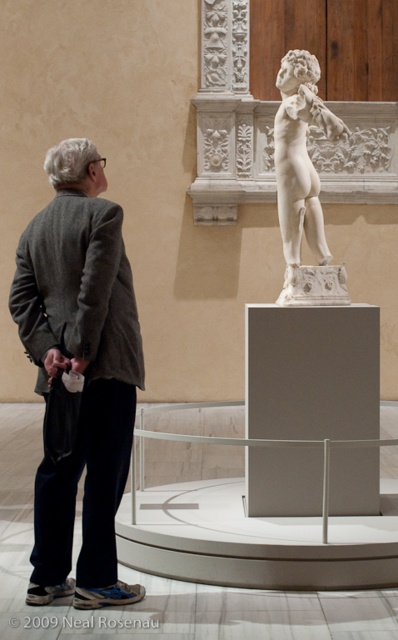
What do you see at coordinates (79, 371) in the screenshot? I see `gray wool jacket at left` at bounding box center [79, 371].

Does gray wool jacket at left have a larger size compared to white marble statue at center?

Correct, gray wool jacket at left is larger in size than white marble statue at center.

Is point (101, 323) closer to camera compared to point (292, 186)?

Yes, it is in front of point (292, 186).

This screenshot has width=398, height=640. What are the coordinates of `gray wool jacket at left` in the screenshot? It's located at (79, 371).